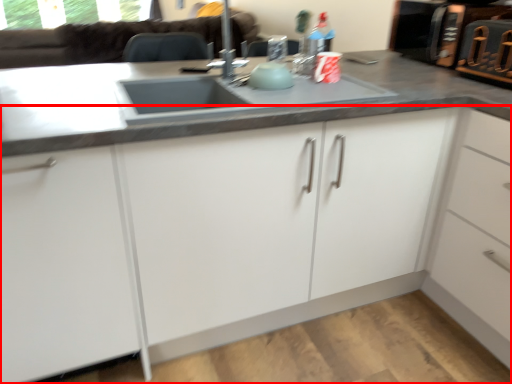
Question: From the image's perspective, where is cabinetry (annotated by the red box) located relative to appliance?

Choices:
 (A) below
 (B) above

Answer: (A)